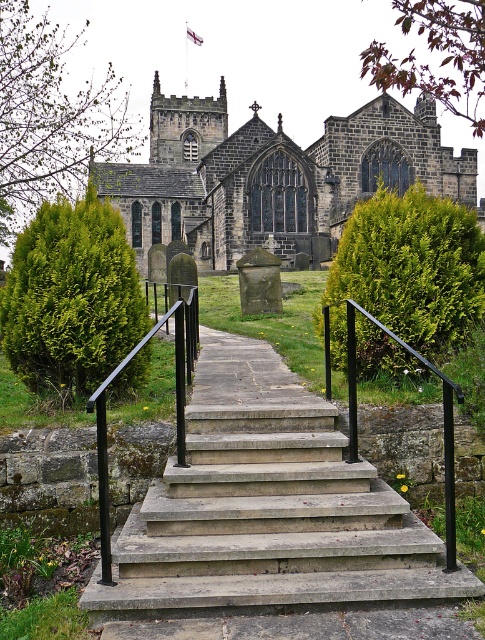
Is black metal handrail at center below black metal/rail at center?

No, black metal handrail at center is not below black metal/rail at center.

Where is `black metal handrail at center`? black metal handrail at center is located at coordinates (176, 403).

Does point (152, 333) lie in front of point (325, 324)?

That is True.

You are a GUI agent. You are given a task and a screenshot of the screen. Output one action in this format:
    pyautogui.click(x=<x>, y=<y>)
    Task: Click on the black metal handrail at center
    The height and width of the screenshot is (640, 485).
    Given the screenshot: What is the action you would take?
    pyautogui.click(x=176, y=403)

Which of these two, concrete steps at center or dark gray stone church at center, stands shorter?

concrete steps at center is shorter.

Can you confirm if concrete steps at center is positioned to the left of dark gray stone church at center?

Incorrect, concrete steps at center is not on the left side of dark gray stone church at center.

Does point (402, 576) come in front of point (143, 237)?

Yes, point (402, 576) is closer to viewer.

Locate an element on the screen. The width and height of the screenshot is (485, 640). concrete steps at center is located at coordinates (272, 525).

Is dark gray stone church at center smaller than black metal handrail at center?

No, dark gray stone church at center is not smaller than black metal handrail at center.

Does dark gray stone church at center appear on the right side of black metal handrail at center?

Correct, you'll find dark gray stone church at center to the right of black metal handrail at center.

What do you see at coordinates (273, 177) in the screenshot? I see `dark gray stone church at center` at bounding box center [273, 177].

You are a GUI agent. You are given a task and a screenshot of the screen. Output one action in this format:
    pyautogui.click(x=<x>, y=<y>)
    Task: Click on the dark gray stone church at center
    The width and height of the screenshot is (485, 640).
    Given the screenshot: What is the action you would take?
    pyautogui.click(x=273, y=177)